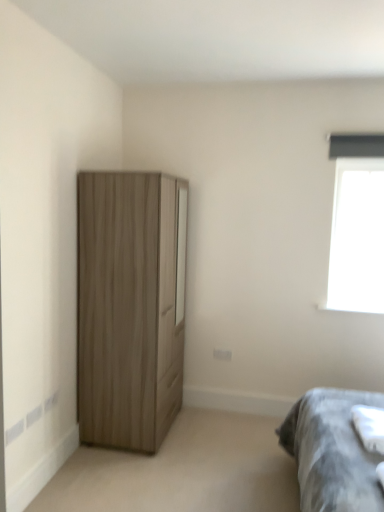
Locate an element on the screen. vacant area that is in front of wooden wardrobe at left is located at coordinates (134, 477).